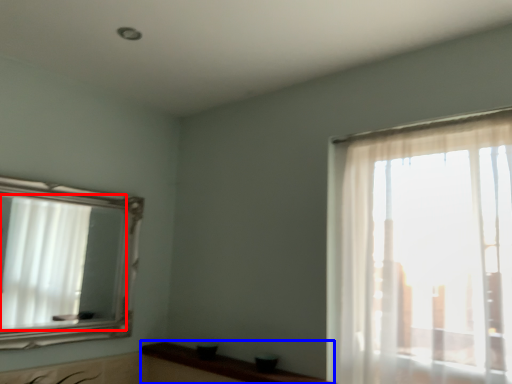
Question: Which point is closer to the camera, mirror (highlighted by a red box) or counter top (highlighted by a blue box)?

Choices:
 (A) mirror
 (B) counter top

Answer: (B)